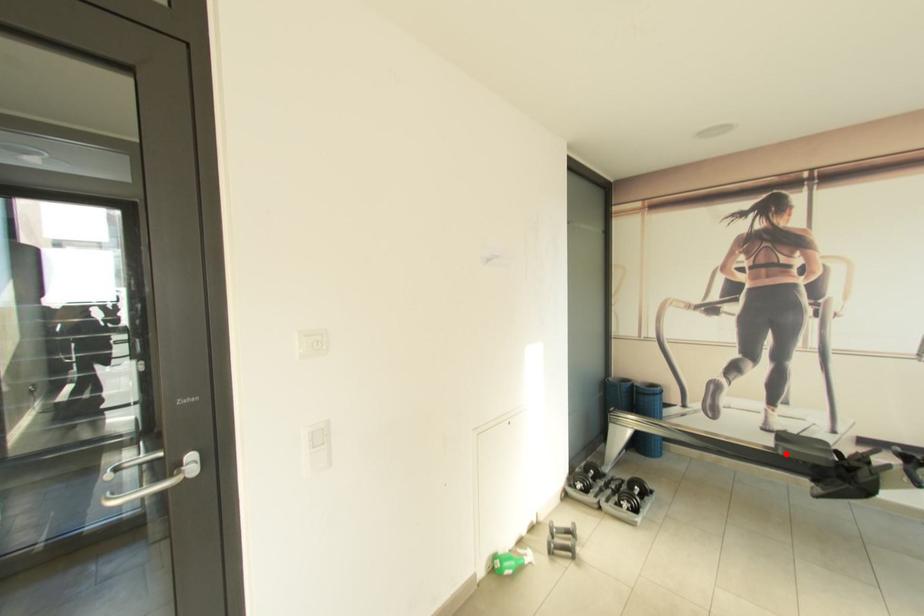
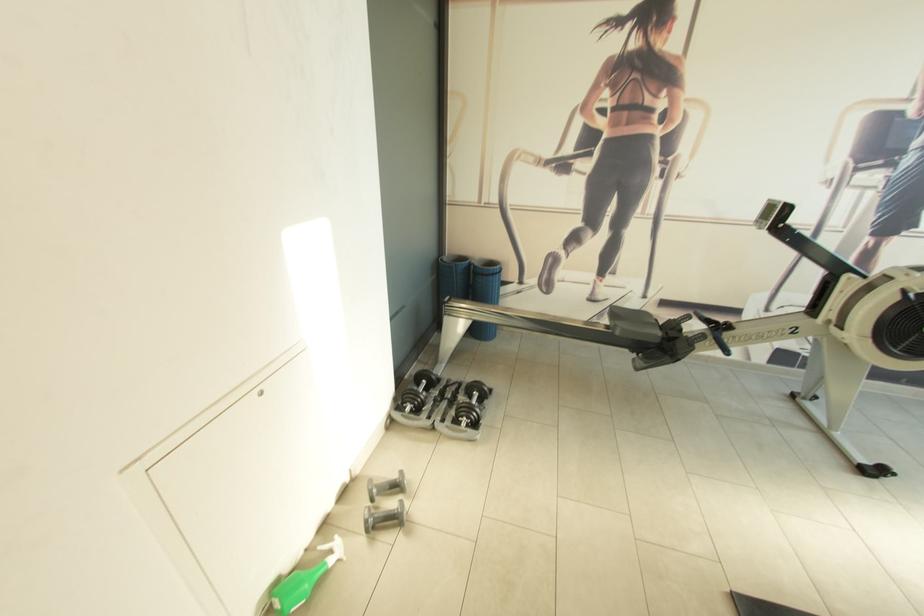
The point at the highlighted location is marked in the first image. Where is the corresponding point in the second image?

(622, 334)